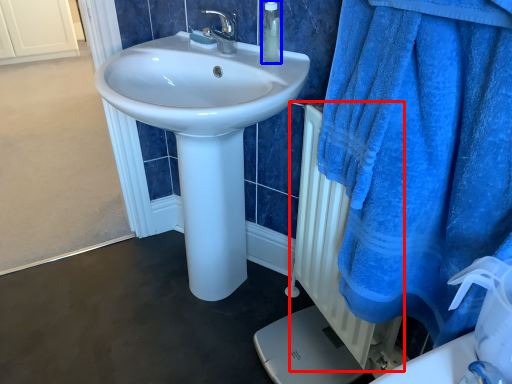
Question: Which of the following is the farthest to the observer, radiator (highlighted by a red box) or soap dispenser (highlighted by a blue box)?

Choices:
 (A) radiator
 (B) soap dispenser

Answer: (B)